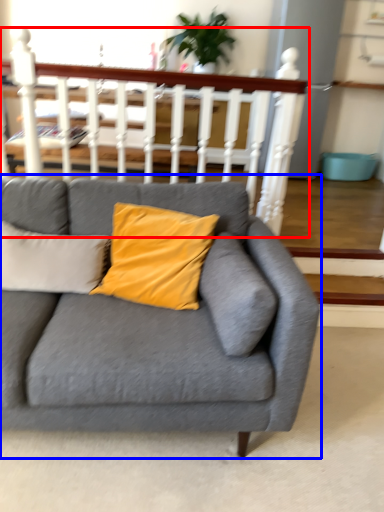
Question: Which object appears closest to the camera in this image, balustrade (highlighted by a red box) or studio couch (highlighted by a blue box)?

Choices:
 (A) balustrade
 (B) studio couch

Answer: (B)